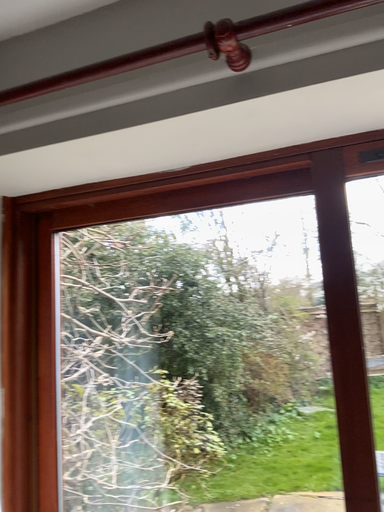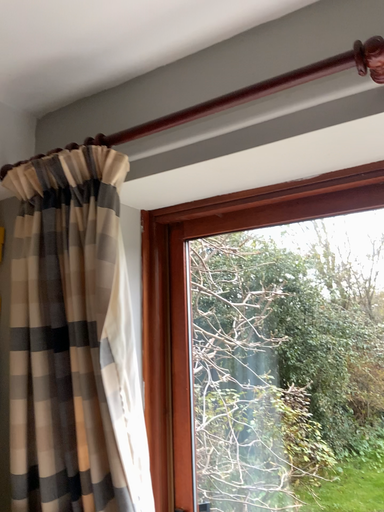
Question: Which way did the camera rotate in the video?

Choices:
 (A) rotated right
 (B) rotated left

Answer: (B)